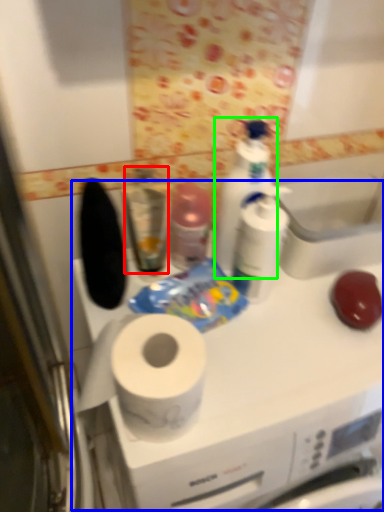
Question: Considering the real-world distances, which object is closest to mouthwash (highlighted by a red box)? counter (highlighted by a blue box) or cleaning product (highlighted by a green box).

Choices:
 (A) counter
 (B) cleaning product

Answer: (B)